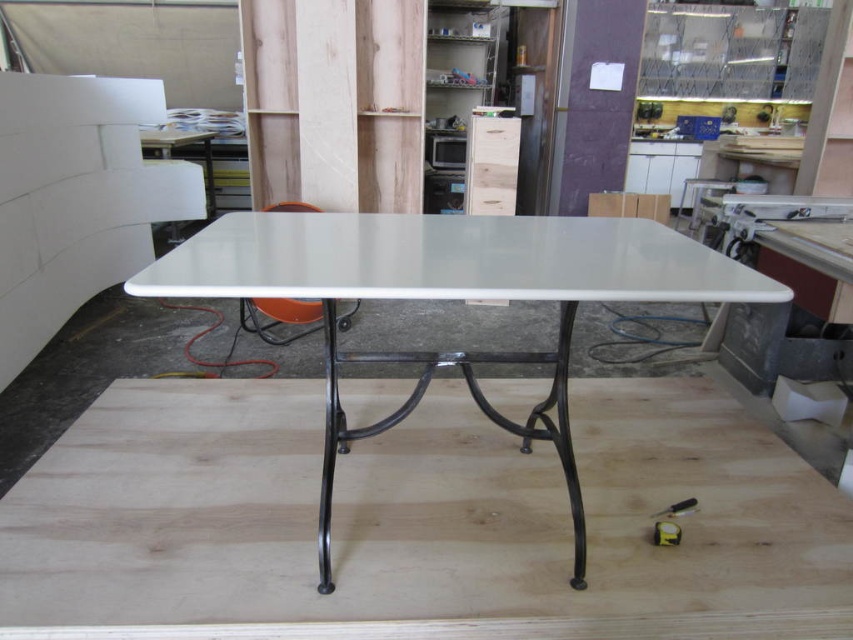
You are organizing the workshop and need to move the natural wood plywood at center and the white glossy table at center. Which object should you lift first if you want to access the one underneath?

You should lift the white glossy table at center first because the natural wood plywood at center is positioned under it, so moving the table would allow access to the plywood underneath.

You are organizing the workshop and need to place the natural wood plywood at center onto the white glossy table at center. Based on their sizes, will the plywood fit entirely on the table without overhanging?

The natural wood plywood at center is smaller than the white glossy table at center, so it will fit entirely on the table without overhanging.